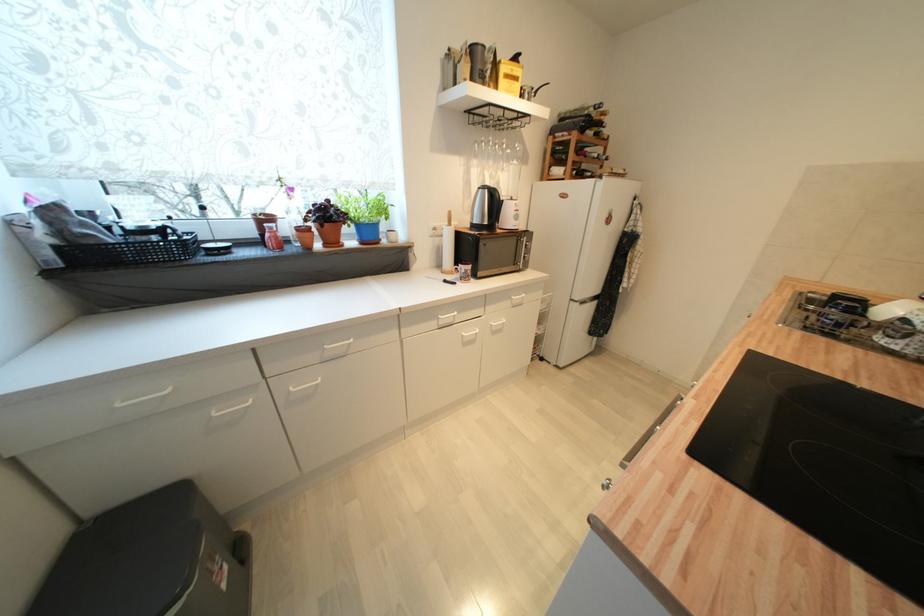
The location [365,214] corresponds to which object?

It corresponds to the blue plant pot in the image.